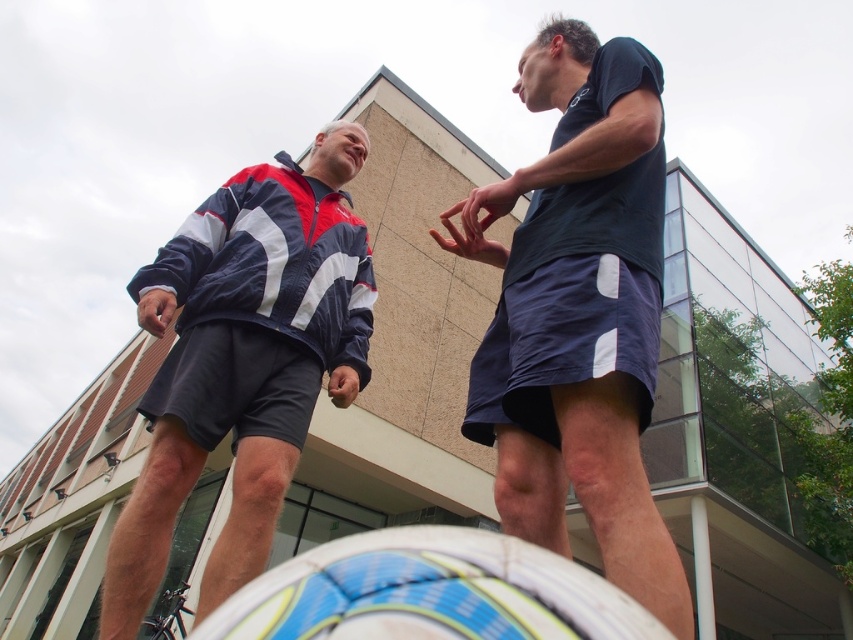
Does dark blue shorts at center have a lesser height compared to blue and white striped jacket at upper left?

Yes.

Can you confirm if dark blue shorts at center is positioned above blue and white striped jacket at upper left?

Indeed, dark blue shorts at center is positioned over blue and white striped jacket at upper left.

At what (x,y) coordinates should I click in order to perform the action: click on dark blue shorts at center. Please return your answer as a coordinate pair (x, y). Looking at the image, I should click on (579, 312).

Can you confirm if dark blue shorts at center is thinner than blue textured soccer ball at lower center?

Yes.

Who is more forward, (x=599, y=112) or (x=566, y=627)?

Point (x=566, y=627) is in front.

Between point (607, 336) and point (447, 556), which one is positioned behind?

Point (607, 336)

The height and width of the screenshot is (640, 853). Find the location of `dark blue shorts at center`. dark blue shorts at center is located at coordinates (579, 312).

Is blue and white striped jacket at upper left to the right of blue textured soccer ball at lower center from the viewer's perspective?

In fact, blue and white striped jacket at upper left is to the left of blue textured soccer ball at lower center.

Can you confirm if blue and white striped jacket at upper left is positioned to the left of blue textured soccer ball at lower center?

Correct, you'll find blue and white striped jacket at upper left to the left of blue textured soccer ball at lower center.

Is point (355, 369) more distant than point (230, 612)?

Yes, it is behind point (230, 612).

The image size is (853, 640). Find the location of `blue and white striped jacket at upper left`. blue and white striped jacket at upper left is located at coordinates (242, 362).